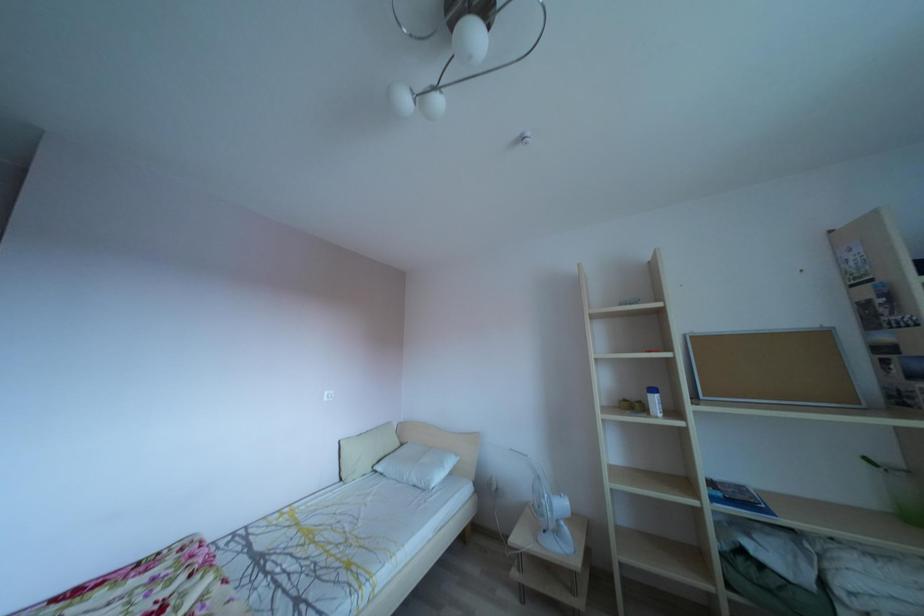
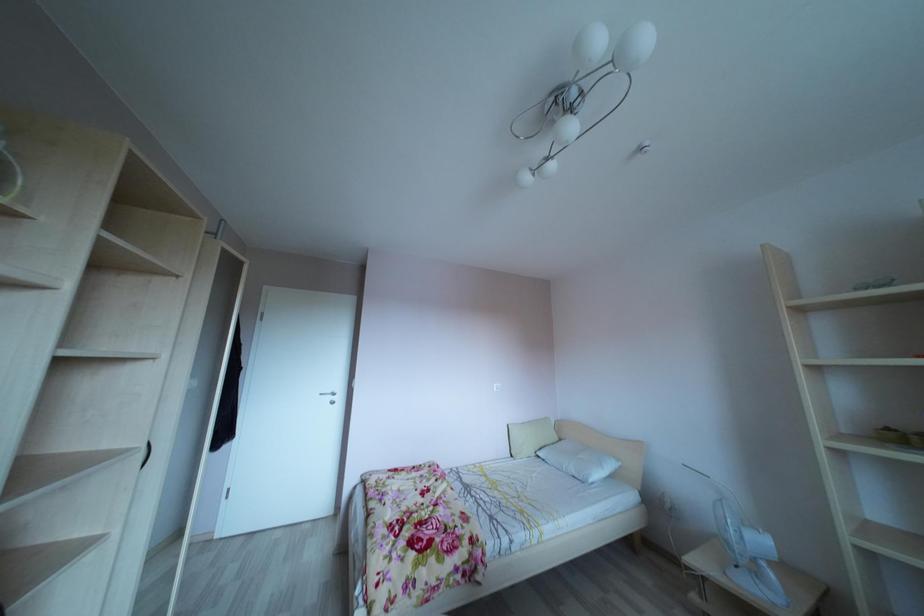
Question: The camera is either moving clockwise (left) or counter-clockwise (right) around the object. The first image is from the beginning of the video and the second image is from the end. Is the camera moving left or right when shooting the video?

Choices:
 (A) Left
 (B) Right

Answer: (B)